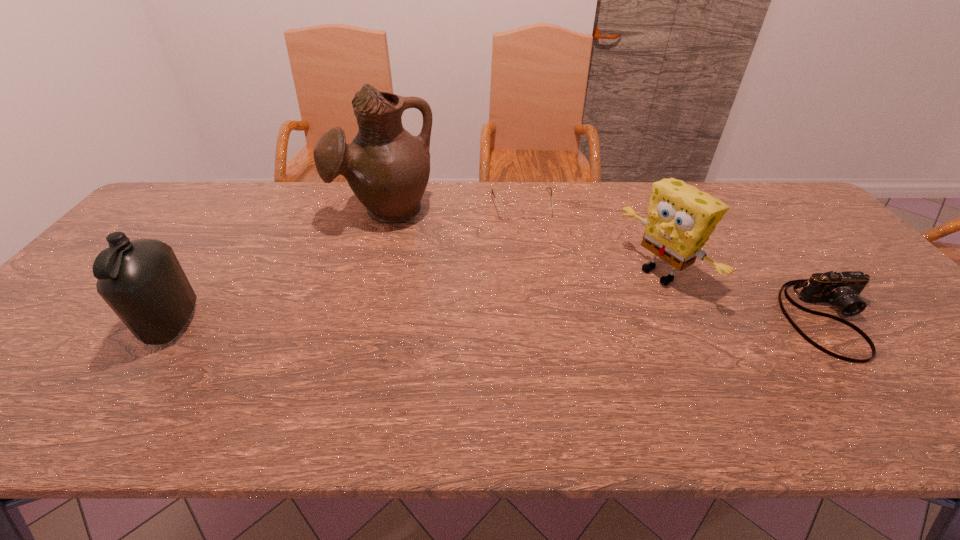
Where is `object positioned at the near edge`? object positioned at the near edge is located at coordinates (842, 289).

The width and height of the screenshot is (960, 540). I want to click on object at the right edge, so click(x=842, y=289).

Identify the location of object that is positioned at the near right corner. The height and width of the screenshot is (540, 960). (842, 289).

Locate an element on the screen. This screenshot has height=540, width=960. vacant space at the far edge of the desktop is located at coordinates (210, 202).

In the image, there is a desktop. At what (x,y) coordinates should I click in order to perform the action: click on vacant space at the near edge. Please return your answer as a coordinate pair (x, y). Image resolution: width=960 pixels, height=540 pixels. Looking at the image, I should click on (155, 386).

The width and height of the screenshot is (960, 540). Find the location of `free space at the right edge of the desktop`. free space at the right edge of the desktop is located at coordinates (895, 327).

Where is `vacant area that lies between the leftmost object and the camera`? The height and width of the screenshot is (540, 960). vacant area that lies between the leftmost object and the camera is located at coordinates (502, 321).

Locate an element on the screen. empty space between the second object from right to left and the bottle is located at coordinates (417, 299).

At what (x,y) coordinates should I click in order to perform the action: click on vacant point located between the bottle and the shortest object. Please return your answer as a coordinate pair (x, y). This screenshot has height=540, width=960. Looking at the image, I should click on (348, 264).

Find the location of a particular element. The width and height of the screenshot is (960, 540). vacant space in between the fourth object from left to right and the bottle is located at coordinates (417, 299).